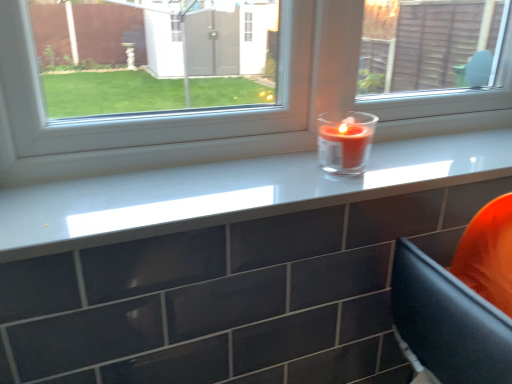
Question: Choose the correct answer: Is transparent glass candle at center inside matte glass candle at upper center or outside it?

Choices:
 (A) outside
 (B) inside

Answer: (A)

Question: In terms of width, does transparent glass candle at center look wider or thinner when compared to matte glass candle at upper center?

Choices:
 (A) thin
 (B) wide

Answer: (A)

Question: Estimate the real-world distances between objects in this image. Which object is farther from the matte glass candle at upper center?

Choices:
 (A) translucent glass candle at center
 (B) transparent glass candle at center

Answer: (A)

Question: Based on their relative distances, which object is farther from the translucent glass candle at center?

Choices:
 (A) transparent glass candle at center
 (B) matte glass candle at upper center

Answer: (A)